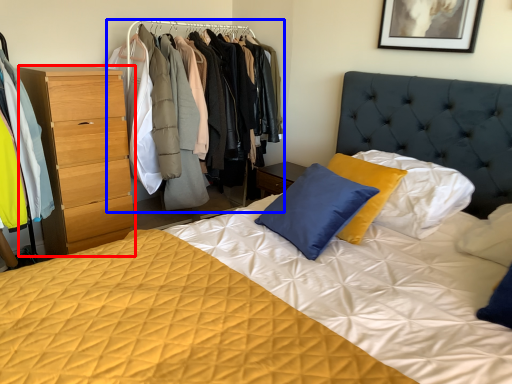
Question: Which object is further to the camera taking this photo, chest of drawers (highlighted by a red box) or dresser (highlighted by a blue box)?

Choices:
 (A) chest of drawers
 (B) dresser

Answer: (B)